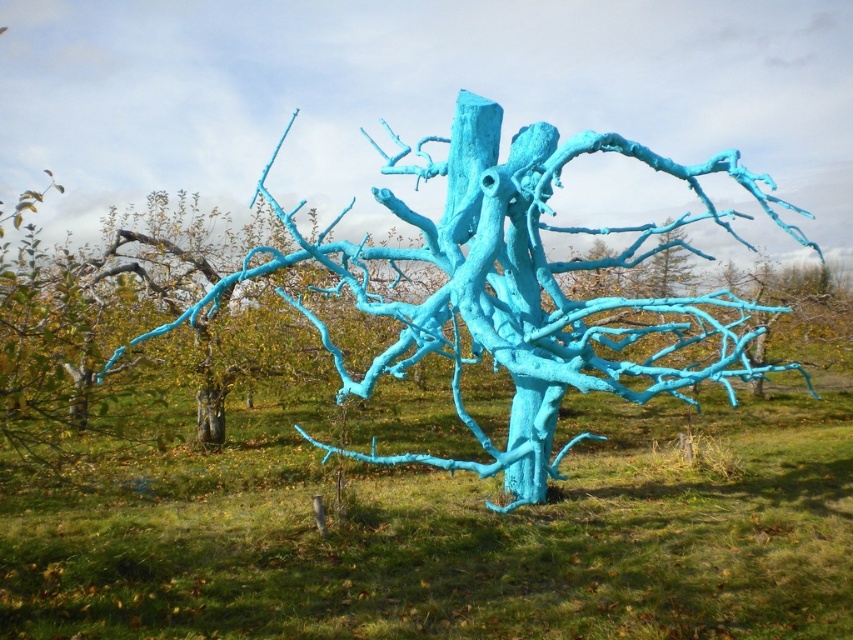
Question: Among these objects, which one is farthest from the camera?

Choices:
 (A) turquoise painted tree at center
 (B) matte blue tree at center

Answer: (B)

Question: Is matte blue tree at center bigger than turquoise painted tree at center?

Choices:
 (A) yes
 (B) no

Answer: (B)

Question: Does matte blue tree at center come behind turquoise painted tree at center?

Choices:
 (A) no
 (B) yes

Answer: (B)

Question: Is matte blue tree at center bigger than turquoise painted tree at center?

Choices:
 (A) no
 (B) yes

Answer: (A)